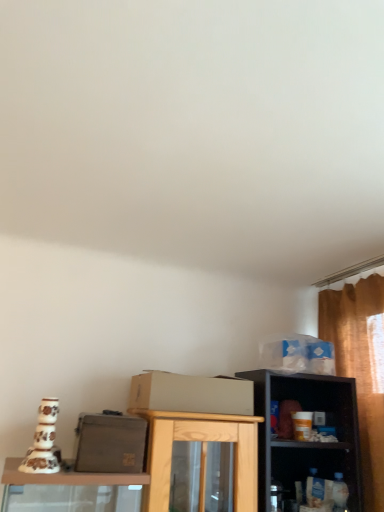
Question: Is blue plastic bag at upper right, placed as the 2th box when sorted from bottom to top, turned away from beige cardboard box at center?

Choices:
 (A) no
 (B) yes

Answer: (A)

Question: Is blue plastic bag at upper right, positioned as the second box in left-to-right order, positioned in front of beige cardboard box at center?

Choices:
 (A) yes
 (B) no

Answer: (B)

Question: Is blue plastic bag at upper right, positioned as the second box in left-to-right order, outside of beige cardboard box at center?

Choices:
 (A) yes
 (B) no

Answer: (A)

Question: From a real-world perspective, does blue plastic bag at upper right, placed as the 1th box when sorted from top to bottom, stand above beige cardboard box at center?

Choices:
 (A) no
 (B) yes

Answer: (B)

Question: Is blue plastic bag at upper right, placed as the 2th box when sorted from bottom to top, taller than beige cardboard box at center?

Choices:
 (A) yes
 (B) no

Answer: (A)

Question: From a real-world perspective, is blue plastic bag at upper right, positioned as the second box in left-to-right order, below beige cardboard box at center?

Choices:
 (A) no
 (B) yes

Answer: (A)

Question: Considering the relative sizes of blue plastic bag at upper right, the 1th box viewed from the back, and white plastic shelf at lower right in the image provided, is blue plastic bag at upper right, the 1th box viewed from the back, smaller than white plastic shelf at lower right?

Choices:
 (A) yes
 (B) no

Answer: (A)

Question: From the image's perspective, does blue plastic bag at upper right, placed as the 2th box when sorted from bottom to top, appear higher than white plastic shelf at lower right?

Choices:
 (A) no
 (B) yes

Answer: (B)

Question: Considering the relative positions of blue plastic bag at upper right, arranged as the 1th box when viewed from the right, and white plastic shelf at lower right in the image provided, is blue plastic bag at upper right, arranged as the 1th box when viewed from the right, in front of white plastic shelf at lower right?

Choices:
 (A) yes
 (B) no

Answer: (B)

Question: Is blue plastic bag at upper right, positioned as the second box in left-to-right order, to the left of white plastic shelf at lower right from the viewer's perspective?

Choices:
 (A) yes
 (B) no

Answer: (A)

Question: From the image's perspective, is blue plastic bag at upper right, positioned as the second box in left-to-right order, under white plastic shelf at lower right?

Choices:
 (A) yes
 (B) no

Answer: (B)

Question: Can you confirm if blue plastic bag at upper right, positioned as the second box in left-to-right order, is thinner than white plastic shelf at lower right?

Choices:
 (A) yes
 (B) no

Answer: (A)

Question: Can you confirm if matte gray box at center, which is the 1th box from left to right, is taller than beige cardboard box at center?

Choices:
 (A) no
 (B) yes

Answer: (B)